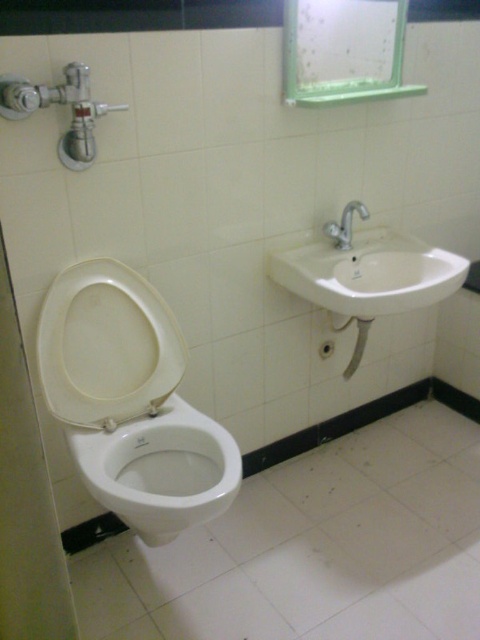
You are a plumber inspecting the bathroom. You need to access the silver water valve behind the white matte toilet lid at center. Can you reach it without moving the white ceramic sink at upper right?

The white matte toilet lid at center is in front of the white ceramic sink at upper right, so you can reach the silver water valve behind the white matte toilet lid at center without needing to move the white ceramic sink at upper right.

You are a plumber inspecting the bathroom. You need to replace the silver metallic faucet at upper right and the white glossy bidet at lower left. Which one requires a larger replacement part?

The white glossy bidet at lower left requires a larger replacement part since it is bigger than the silver metallic faucet at upper right.